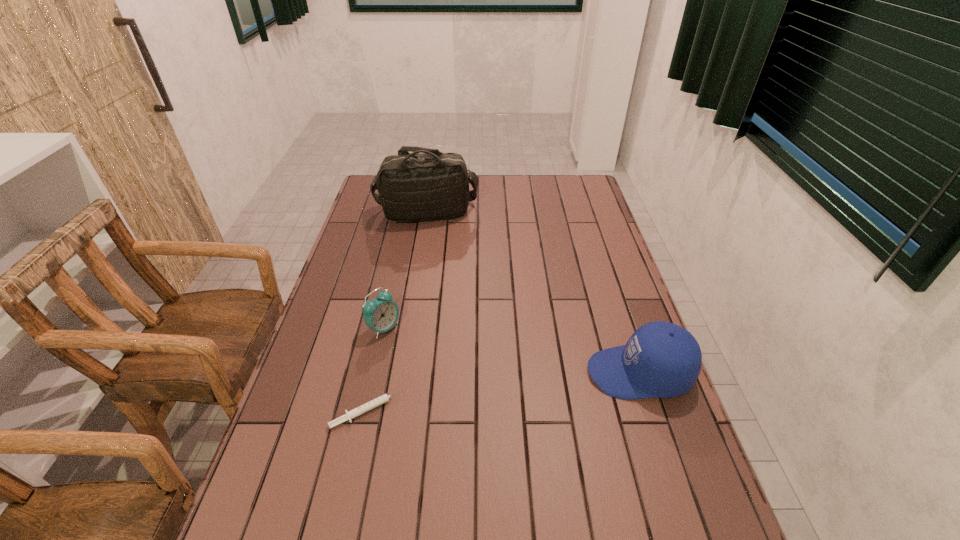
The width and height of the screenshot is (960, 540). In order to click on vacant region located on the face of the third nearest object in this screenshot , I will do `click(470, 369)`.

Image resolution: width=960 pixels, height=540 pixels. I want to click on blank area located 0.380m on the face of the third nearest object, so click(519, 391).

Locate an element on the screen. This screenshot has height=540, width=960. vacant space situated at the front padded panel of the tallest object is located at coordinates (448, 237).

Identify the location of blank space located at the front padded panel of the tallest object. The image size is (960, 540). (472, 279).

Locate an element on the screen. Image resolution: width=960 pixels, height=540 pixels. blank space located 0.240m at the front padded panel of the tallest object is located at coordinates point(466,266).

Where is `object that is at the far edge`? The height and width of the screenshot is (540, 960). object that is at the far edge is located at coordinates pos(426,185).

Locate an element on the screen. The height and width of the screenshot is (540, 960). syringe positioned at the left edge is located at coordinates (374, 403).

Where is `alarm clock at the left edge`? Image resolution: width=960 pixels, height=540 pixels. alarm clock at the left edge is located at coordinates (381, 314).

Image resolution: width=960 pixels, height=540 pixels. In order to click on shoulder bag located in the left edge section of the desktop in this screenshot , I will do `click(426, 185)`.

Identify the location of object at the right edge. (661, 359).